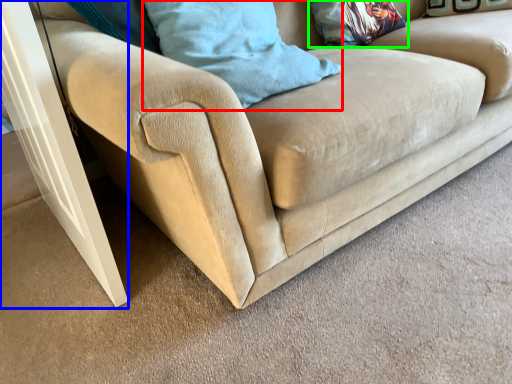
Question: Which object is the farthest from pillow (highlighted by a red box)? Choose among these: screen door (highlighted by a blue box) or pillow (highlighted by a green box).

Choices:
 (A) screen door
 (B) pillow

Answer: (B)